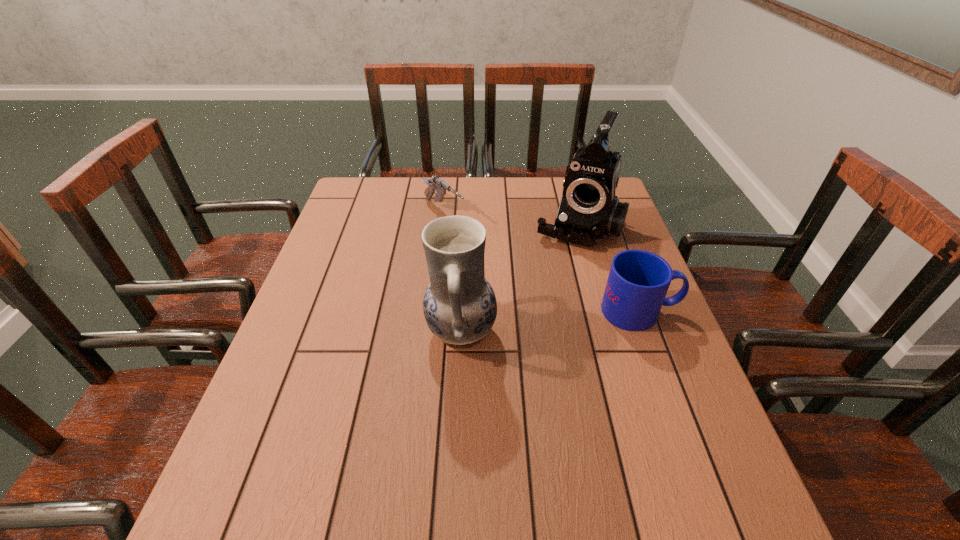
Where is `free region located 0.090m on the lens mount of the camcorder`? This screenshot has height=540, width=960. free region located 0.090m on the lens mount of the camcorder is located at coordinates (558, 270).

Identify the location of gun at the far edge. Image resolution: width=960 pixels, height=540 pixels. (436, 183).

Identify the location of camcorder present at the far edge. (589, 211).

You are a GUI agent. You are given a task and a screenshot of the screen. Output one action in this format:
    pyautogui.click(x=<x>, y=<y>)
    Task: Click on the mug that is at the right edge
    Image resolution: width=960 pixels, height=540 pixels.
    Given the screenshot: What is the action you would take?
    [x=638, y=281]

At what (x,y) coordinates should I click in order to perform the action: click on camcorder that is at the right edge. Please return your answer as a coordinate pair (x, y). Image resolution: width=960 pixels, height=540 pixels. Looking at the image, I should click on (589, 211).

Find the location of a particular element. The height and width of the screenshot is (540, 960). object present at the far right corner is located at coordinates (589, 211).

This screenshot has width=960, height=540. I want to click on vacant region at the far edge, so click(397, 184).

In the image, there is a desktop. Where is `free space at the near edge`? free space at the near edge is located at coordinates (389, 458).

This screenshot has width=960, height=540. In the image, there is a desktop. Find the location of `vacant space at the left edge`. vacant space at the left edge is located at coordinates (319, 312).

You are a GUI agent. You are given a task and a screenshot of the screen. Output one action in this format:
    pyautogui.click(x=<x>, y=<y>)
    Task: Click on the free space at the right edge
    The width and height of the screenshot is (960, 540).
    Given the screenshot: What is the action you would take?
    pyautogui.click(x=608, y=260)